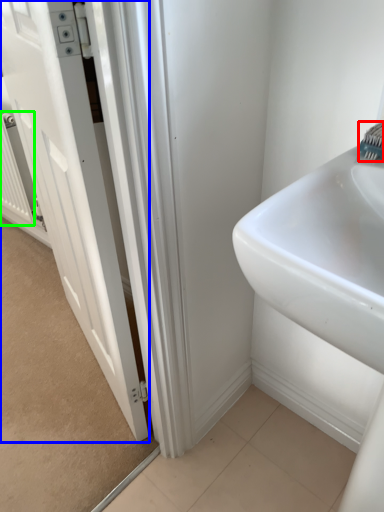
Question: Estimate the real-world distances between objects in this image. Which object is closer to brush (highlighted by a red box), door (highlighted by a blue box) or radiator (highlighted by a green box)?

Choices:
 (A) door
 (B) radiator

Answer: (A)